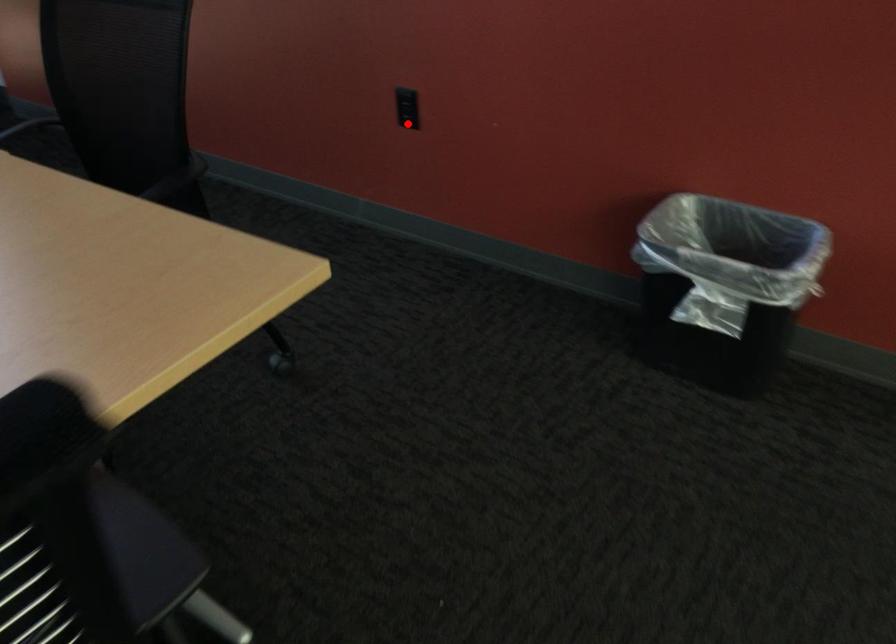
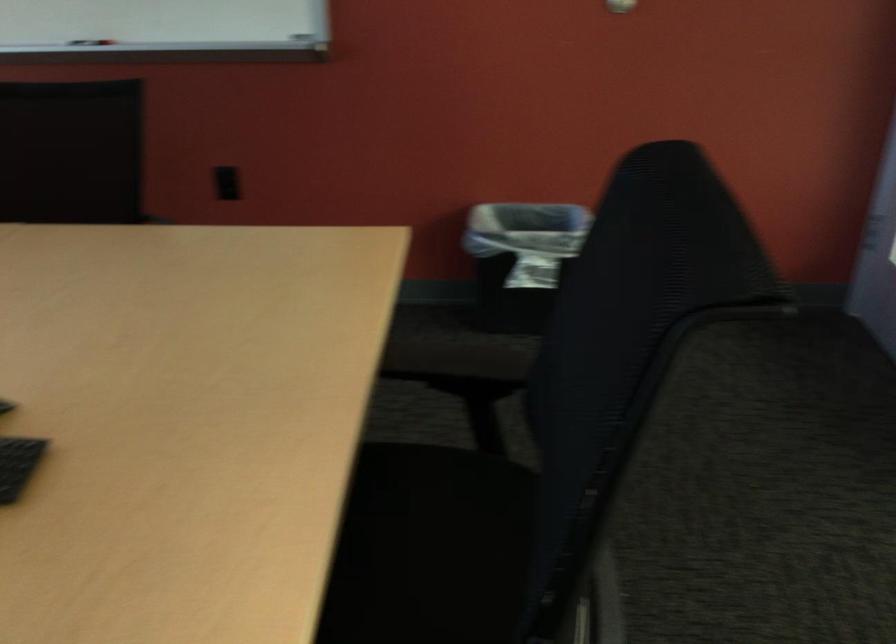
Locate, in the second image, the point that corresponds to the highlighted location in the first image.

(227, 183)